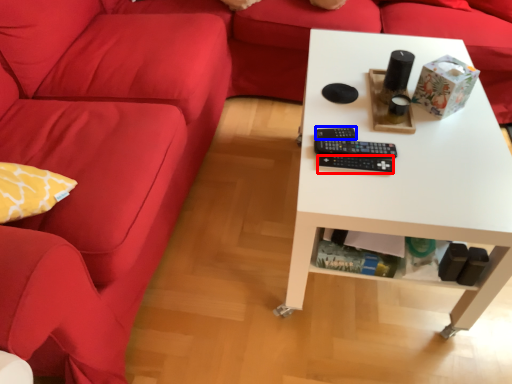
Question: Which point is closer to the camera, control (highlighted by a red box) or control (highlighted by a blue box)?

Choices:
 (A) control
 (B) control

Answer: (A)